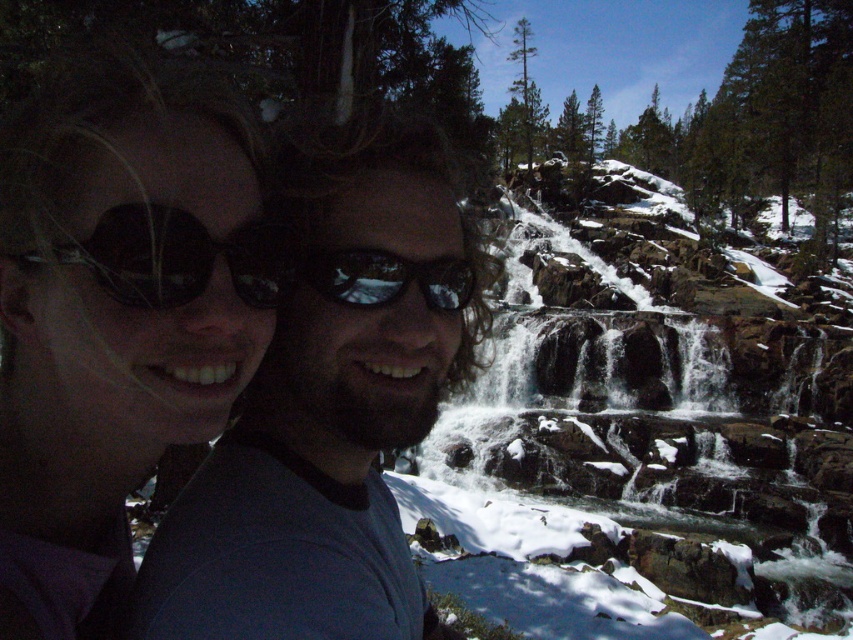
You are a photographer trying to capture the matte black sunglasses at upper left and the black reflective sunglasses at center in a single shot. Which sunglasses are closer to the camera?

The matte black sunglasses at upper left is positioned under the black reflective sunglasses at center, so the black reflective sunglasses at center is closer to the camera.

You are a photographer trying to capture the waterfall scene. You notice two pairs of sunglasses in the frame. Which pair is positioned more to the left between the matte black sunglasses at upper left and the black reflective sunglasses at center?

The matte black sunglasses at upper left is positioned more to the left compared to the black reflective sunglasses at center as it is located to the left of the latter.

You are a photographer trying to capture the best shot of the two points in the scene. Which point, point (36, 257) or point (462, 296), is positioned closer to the camera?

Point (36, 257) is closer to the camera than point (462, 296).